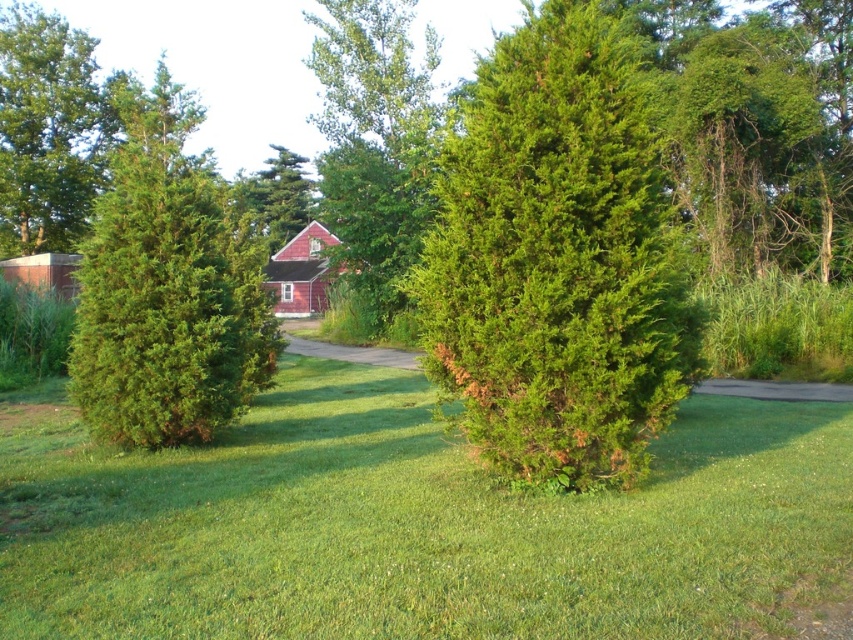
Question: Which object appears farthest from the camera in this image?

Choices:
 (A) green leafy tree at center
 (B) green textured shrub at center

Answer: (A)

Question: Does green grass at center have a greater width compared to green textured bush at left?

Choices:
 (A) no
 (B) yes

Answer: (A)

Question: Is green leafy tree at center above green textured pine tree at center?

Choices:
 (A) yes
 (B) no

Answer: (A)

Question: Which point appears closest to the camera in this image?

Choices:
 (A) (265, 172)
 (B) (328, 76)
 (C) (793, 38)
 (D) (718, 435)

Answer: (D)

Question: Which point is farther to the camera?

Choices:
 (A) green textured shrub at center
 (B) green textured pine tree at center
 (C) green leafy tree at center

Answer: (C)

Question: Is green textured shrub at center above green textured pine tree at center?

Choices:
 (A) no
 (B) yes

Answer: (A)